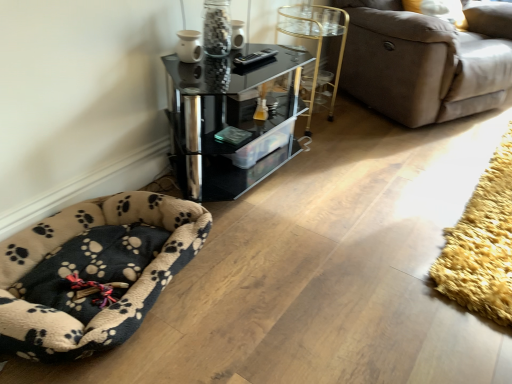
Question: In terms of height, does black glass table at upper center look taller or shorter compared to yellow shaggy rug at lower right?

Choices:
 (A) tall
 (B) short

Answer: (A)

Question: From the image's perspective, is black glass table at upper center positioned above or below yellow shaggy rug at lower right?

Choices:
 (A) below
 (B) above

Answer: (B)

Question: Which object is positioned farthest from the transparent glass jar at upper center?

Choices:
 (A) gold metallic side table at upper center
 (B) black glass table at upper center
 (C) yellow shaggy rug at lower right
 (D) beige fleece dog bed at lower left
 (E) brown fabric couch at upper right

Answer: (C)

Question: Based on their relative distances, which object is nearer to the brown fabric couch at upper right?

Choices:
 (A) beige fleece dog bed at lower left
 (B) gold metallic side table at upper center
 (C) transparent glass jar at upper center
 (D) yellow shaggy rug at lower right
 (E) black glass table at upper center

Answer: (B)